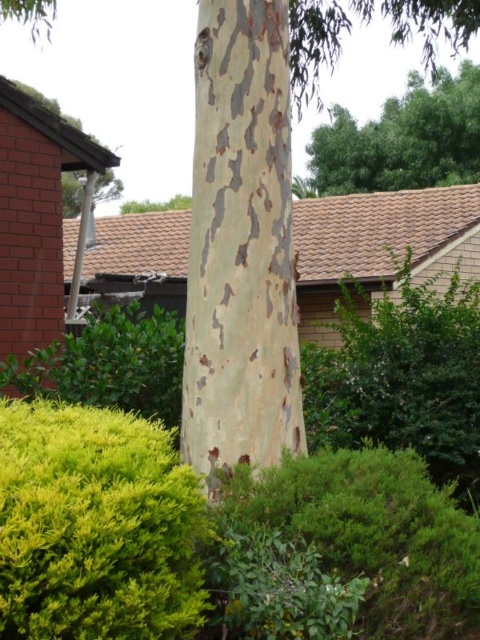
You are a gardener standing in front of the speckled bark tree trunk at center and the green leafy bush at lower center. Which object is positioned higher in the scene?

The speckled bark tree trunk at center is positioned higher than the green leafy bush at lower center.

You are standing in front of the tree trunk and want to find the green leafy bush at lower center. Which direction should you look relative to the green leafy bush at center?

The green leafy bush at lower center is located below the green leafy bush at center, so you should look downward from the green leafy bush at center to find it.